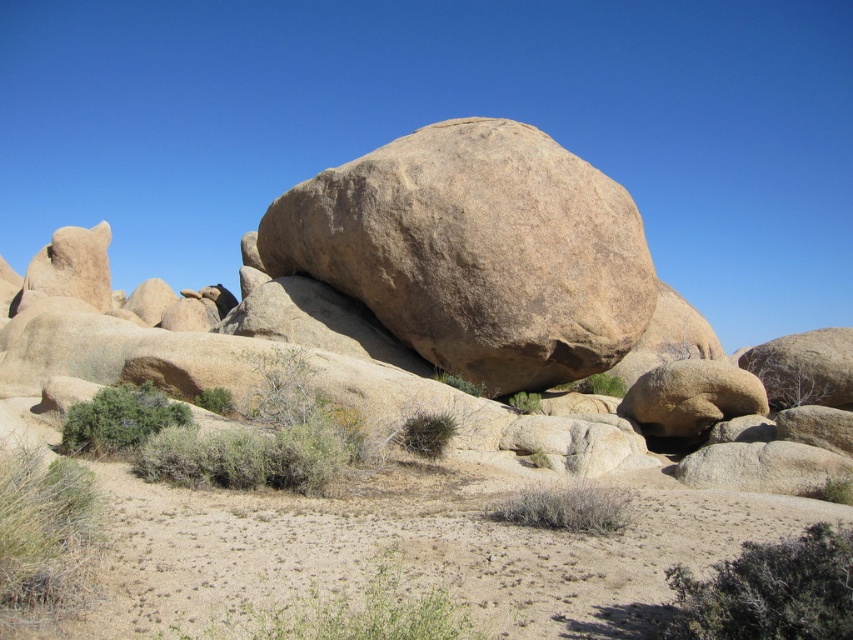
Question: Which of the following is the farthest from the observer?

Choices:
 (A) (740, 444)
 (B) (587, 362)

Answer: (B)

Question: Can you confirm if smooth beige rock at center is thinner than brown rough boulder at center?

Choices:
 (A) no
 (B) yes

Answer: (A)

Question: Among these objects, which one is farthest from the camera?

Choices:
 (A) smooth beige rock at center
 (B) brown rough boulder at center

Answer: (B)

Question: Considering the relative positions of smooth beige rock at center and brown rough boulder at center in the image provided, where is smooth beige rock at center located with respect to brown rough boulder at center?

Choices:
 (A) left
 (B) right

Answer: (A)

Question: Is smooth beige rock at center to the left of brown rough boulder at center from the viewer's perspective?

Choices:
 (A) no
 (B) yes

Answer: (B)